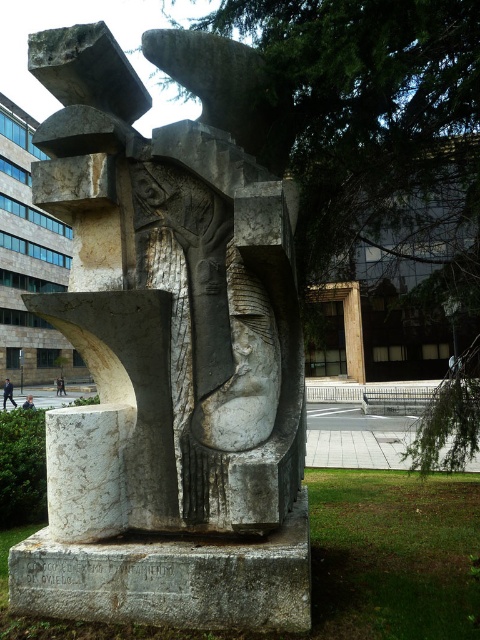
You are a visitor at the sculpture garden and see the point marked at coordinates (8, 394). What object is located at that point?

The point at coordinates (8, 394) marks the location of the dark suit at lower left.

You are a photographer standing in front of the modernist stone sculpture. You notice a person wearing a dark suit at lower left and dark blue jeans at lower left in the image. Which piece of clothing appears bigger in the photo?

The dark suit at lower left is larger in size than the dark blue jeans at lower left, so the dark suit at lower left appears bigger in the photo.

You are standing in a public plaza and see the white marble sculpture at center and the dark blue jeans at lower left. Which object is positioned more to the right side of the plaza?

The white marble sculpture at center is positioned more to the right side of the plaza than the dark blue jeans at lower left.